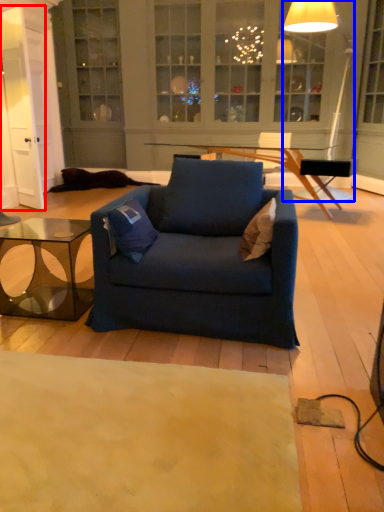
Question: Which point is further to the camera, glass door (highlighted by a red box) or lamp (highlighted by a blue box)?

Choices:
 (A) glass door
 (B) lamp

Answer: (A)